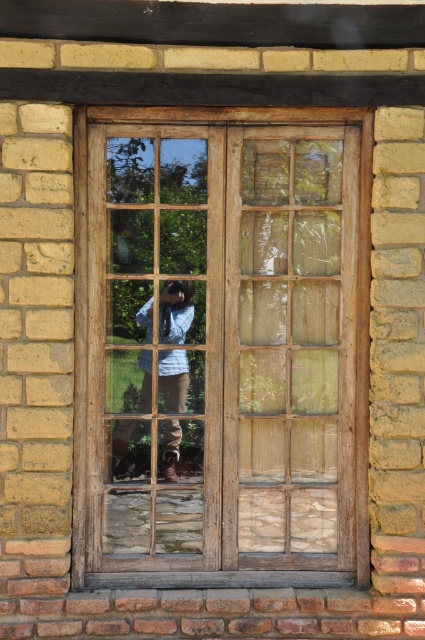
Is wooden window frame at center behind blue denim shirt at center?

That is False.

This screenshot has height=640, width=425. What are the coordinates of `wooden window frame at center` in the screenshot? It's located at (221, 346).

Find the location of a particular element. wooden window frame at center is located at coordinates (221, 346).